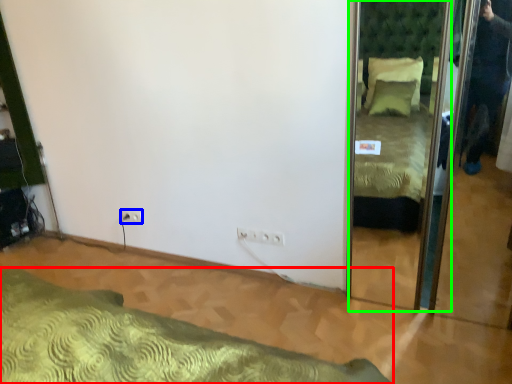
Question: Based on their relative distances, which object is nearer to bed (highlighted by a red box)? Choose from electric outlet (highlighted by a blue box) and mirror (highlighted by a green box).

Choices:
 (A) electric outlet
 (B) mirror

Answer: (A)